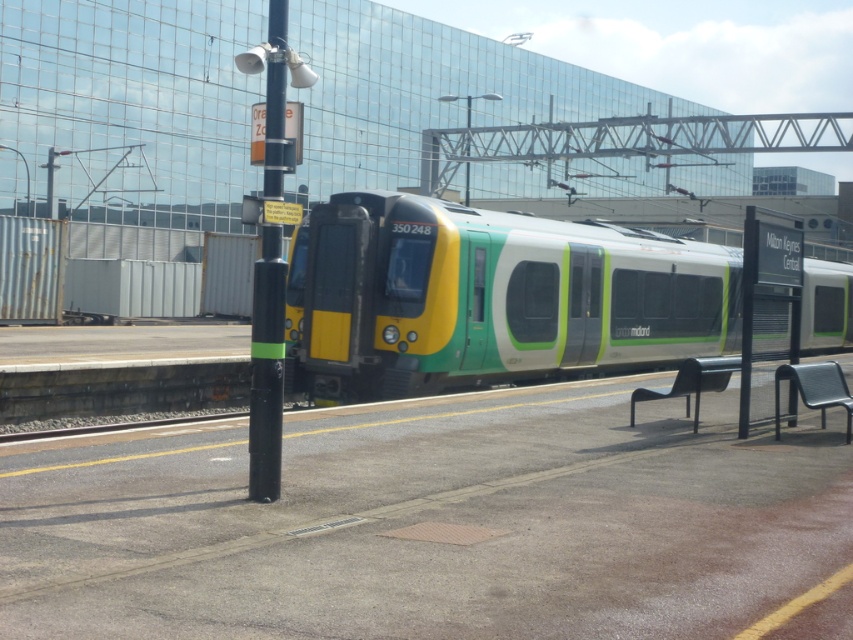
You are standing on the platform at the railway station. You want to board the green matte train at center. If you are currently at the position with coordinates 0,0, which direction should you move to reach the train?

Since the green matte train at center is located at coordinates (490, 298), you should move towards the northeast direction to reach it.